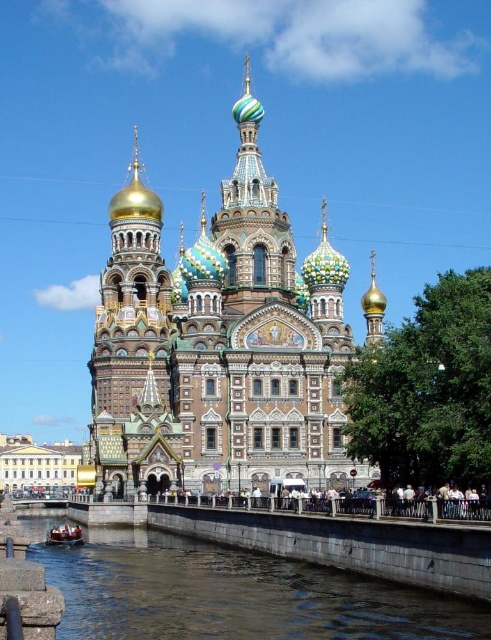
Question: Observing the image, what is the correct spatial positioning of gold mosaic church at center in reference to clear water at lower center?

Choices:
 (A) below
 (B) above

Answer: (B)

Question: Which object is closer to the camera taking this photo?

Choices:
 (A) metallic polished boat at lower left
 (B) clear water at lower center

Answer: (B)

Question: Which object appears closest to the camera in this image?

Choices:
 (A) clear water at lower center
 (B) gold mosaic church at center
 (C) metallic polished boat at lower left

Answer: (A)

Question: Can you confirm if gold mosaic church at center is thinner than metallic polished boat at lower left?

Choices:
 (A) no
 (B) yes

Answer: (A)

Question: Among these points, which one is farthest from the camera?

Choices:
 (A) (158, 198)
 (B) (152, 620)
 (C) (67, 532)

Answer: (A)

Question: Is clear water at lower center smaller than metallic polished boat at lower left?

Choices:
 (A) yes
 (B) no

Answer: (B)